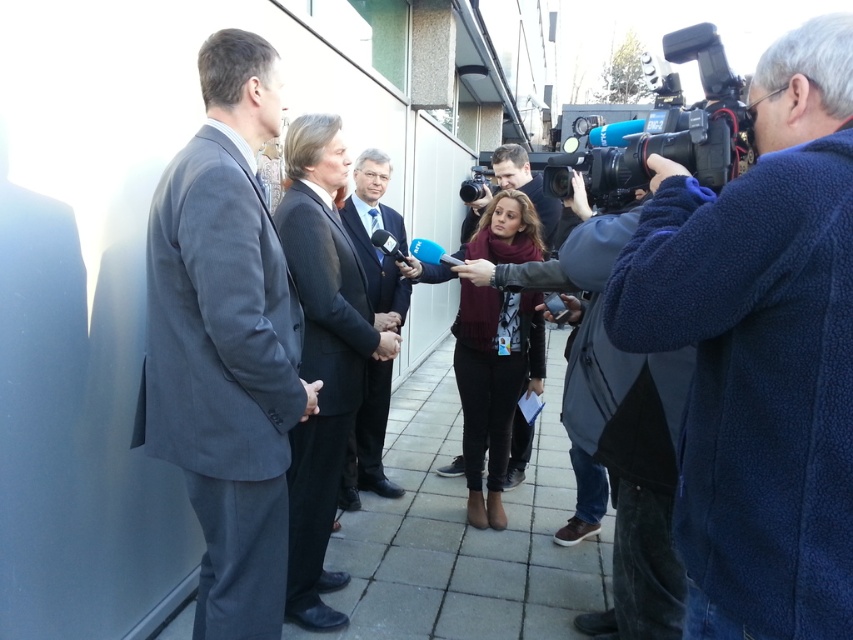
You are a photographer positioned behind the woman with the microphone. You need to capture a photo that includes both the dark gray suit at left and the dark blue woolen suit at center. Given that your camera has a maximum focus range of 1.3 meters, will you be able to fit both subjects within the frame?

The distance between the dark gray suit at left and the dark blue woolen suit at center is 1.26 meters, which is within the camera maximum focus range of 1.3 meters. Therefore, you can fit both subjects within the frame.

You are a photographer standing at the center of the scene. You want to take a photo that includes both the dark gray suit at left and the woman holding a microphone with a blue logo. What is the minimum distance you need to move backward to ensure both subjects are in frame?

The minimum distance to move backward is 1.56 meters to include both the dark gray suit at left and the woman holding a microphone with a blue logo in the frame.

You are a photographer positioned at the center of the scene. You need to capture a photo that includes both the blue fleece jacket at right and the woman holding the microphone with a blue logo. Based on their positions, will you be able to frame both subjects in the same shot without moving your camera?

The blue fleece jacket at right is located at point (759, 349), which means it is positioned to the right side of the scene. The woman holding the microphone with a blue logo is centrally located. Since both subjects are within the same general area of the frame, you should be able to capture both in a single shot without moving the camera.